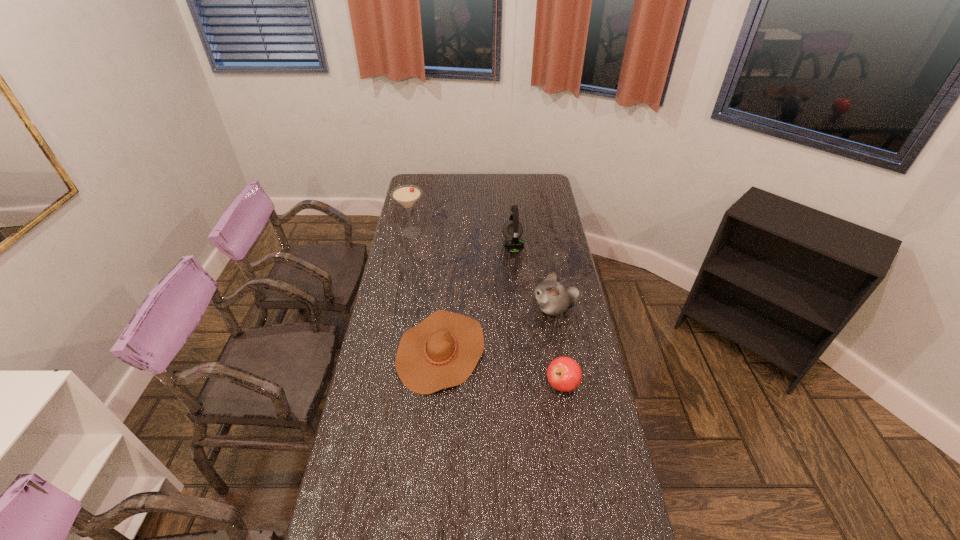
The width and height of the screenshot is (960, 540). I want to click on vacant space situated on the face of the third tallest object, so click(512, 308).

Where is `free location located on the face of the third tallest object`? The image size is (960, 540). free location located on the face of the third tallest object is located at coordinates (514, 308).

Locate an element on the screen. This screenshot has width=960, height=540. free space located on the front of the apple is located at coordinates (578, 483).

Identify the location of vacant space located 0.270m on the front of the shortest object. The height and width of the screenshot is (540, 960). (430, 478).

This screenshot has width=960, height=540. In order to click on martini at the left edge in this screenshot , I will do `click(406, 195)`.

Where is `cowboy hat at the left edge`? The height and width of the screenshot is (540, 960). cowboy hat at the left edge is located at coordinates (442, 351).

You are a GUI agent. You are given a task and a screenshot of the screen. Output one action in this format:
    pyautogui.click(x=<x>, y=<y>)
    Task: Click on the hamster that is at the right edge
    Image resolution: width=960 pixels, height=540 pixels.
    Given the screenshot: What is the action you would take?
    pyautogui.click(x=553, y=298)

At what (x,y) coordinates should I click in order to perform the action: click on apple at the right edge. Please return your answer as a coordinate pair (x, y). This screenshot has height=540, width=960. Looking at the image, I should click on (564, 374).

Find the location of a particular element. The image size is (960, 540). vacant space at the far edge of the desktop is located at coordinates (521, 191).

The width and height of the screenshot is (960, 540). In order to click on free space at the left edge of the desktop in this screenshot , I will do `click(430, 199)`.